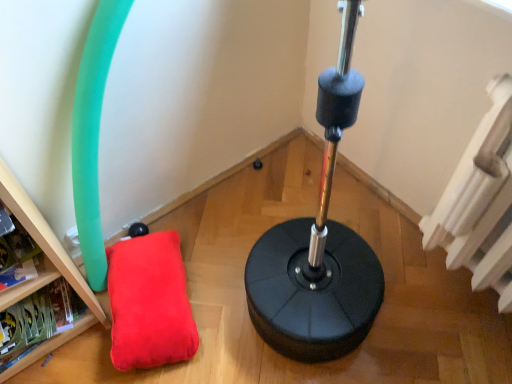
Question: Could you tell me if wooden bookshelf at lower left is turned towards velvet red pillow at lower left?

Choices:
 (A) yes
 (B) no

Answer: (B)

Question: Is wooden bookshelf at lower left smaller than velvet red pillow at lower left?

Choices:
 (A) no
 (B) yes

Answer: (B)

Question: Is wooden bookshelf at lower left to the left of velvet red pillow at lower left from the viewer's perspective?

Choices:
 (A) yes
 (B) no

Answer: (A)

Question: Can you confirm if wooden bookshelf at lower left is thinner than velvet red pillow at lower left?

Choices:
 (A) yes
 (B) no

Answer: (A)

Question: From a real-world perspective, is wooden bookshelf at lower left positioned under velvet red pillow at lower left based on gravity?

Choices:
 (A) no
 (B) yes

Answer: (A)

Question: Would you say wooden bookshelf at lower left is outside velvet red pillow at lower left?

Choices:
 (A) no
 (B) yes

Answer: (B)

Question: Is velvet red pillow at lower left to the left of white textured radiator at upper right from the viewer's perspective?

Choices:
 (A) no
 (B) yes

Answer: (B)

Question: Are velvet red pillow at lower left and white textured radiator at upper right far apart?

Choices:
 (A) no
 (B) yes

Answer: (A)

Question: Is velvet red pillow at lower left directly adjacent to white textured radiator at upper right?

Choices:
 (A) yes
 (B) no

Answer: (B)

Question: Does velvet red pillow at lower left have a greater width compared to white textured radiator at upper right?

Choices:
 (A) yes
 (B) no

Answer: (A)

Question: From the image's perspective, is velvet red pillow at lower left located above white textured radiator at upper right?

Choices:
 (A) no
 (B) yes

Answer: (A)

Question: From a real-world perspective, is velvet red pillow at lower left physically above white textured radiator at upper right?

Choices:
 (A) yes
 (B) no

Answer: (B)

Question: Is white textured radiator at upper right shorter than wooden bookshelf at lower left?

Choices:
 (A) no
 (B) yes

Answer: (A)